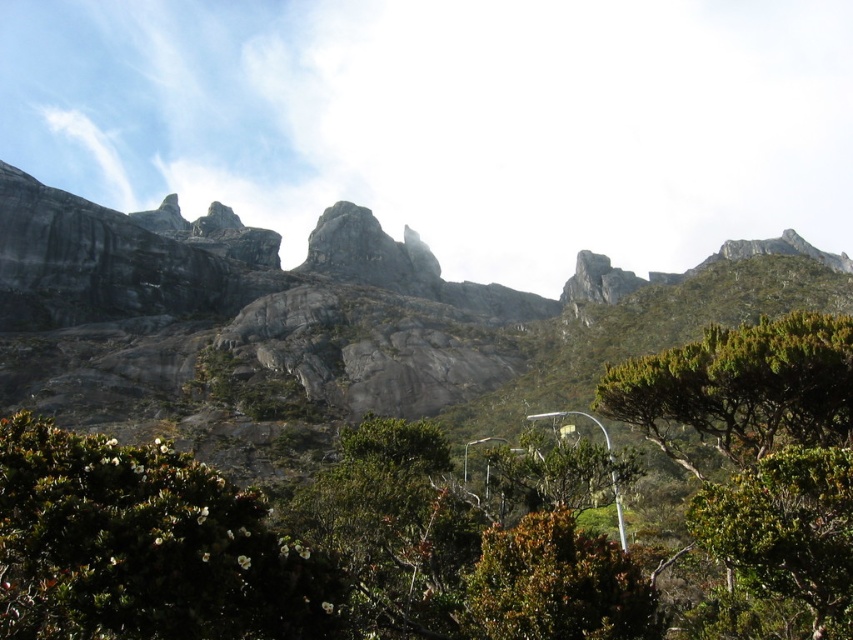
You are standing in the mountainous landscape and want to take a photo. There are two points marked in the scene. Which point is closer to your camera lens? Please choose between the point at coordinates (589, 556) and the point at coordinates (567, 440).

The point at coordinates (589, 556) is closer to the camera lens than the point at coordinates (567, 440).

You are a hiker standing at the base of the gray rock mountain at center. You notice a green leafy shrub at lower right. From your current position, which object is closer to you?

The green leafy shrub at lower right is behind the gray rock mountain at center, so the gray rock mountain at center is closer to you.

You are a hiker who wants to take a photo of the mountain peaks. You have a camera with a wide angle lens. You are standing between the green leafy shrub at center and the green leafy shrub at lower right. Which shrub should you stand closer to in order to capture both the mountain peaks and the shrubs in your photo?

To capture both the mountain peaks and the shrubs in your photo, you should stand closer to the green leafy shrub at lower right. Since the green leafy shrub at center is below the green leafy shrub at lower right, positioning yourself closer to the lower right shrub will allow you to include both the foreground shrubs and the distant mountain peaks in your wide angle shot.